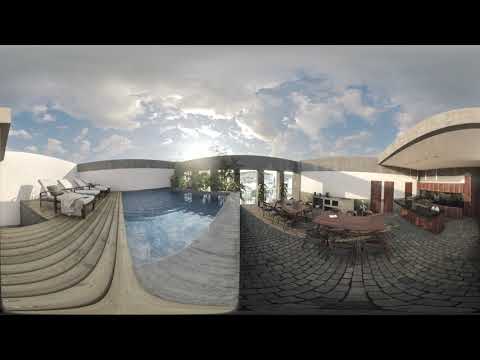
This screenshot has height=360, width=480. What are the coordinates of `stairs` in the screenshot? It's located at (50, 276).